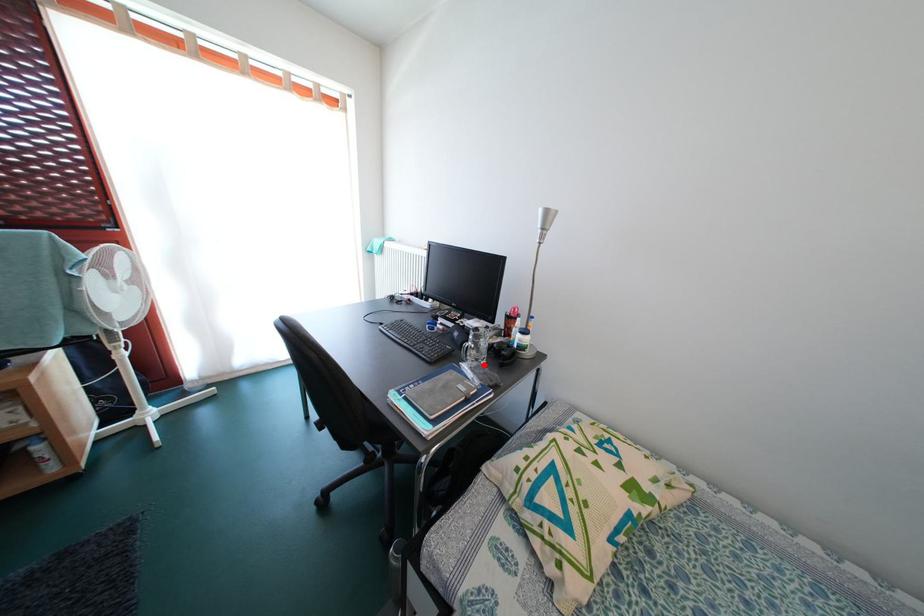
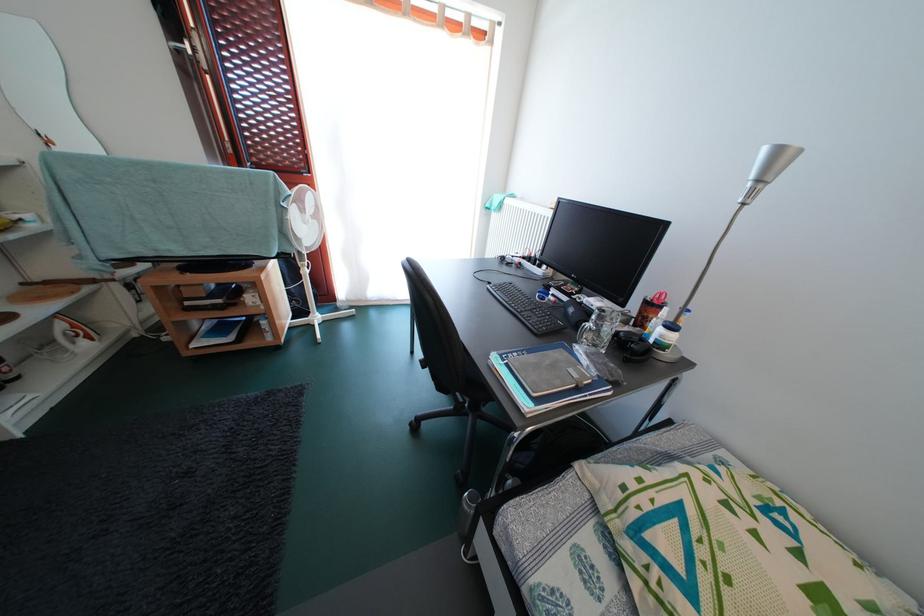
Locate, in the second image, the point that corresponds to the highlighted location in the first image.

(602, 351)